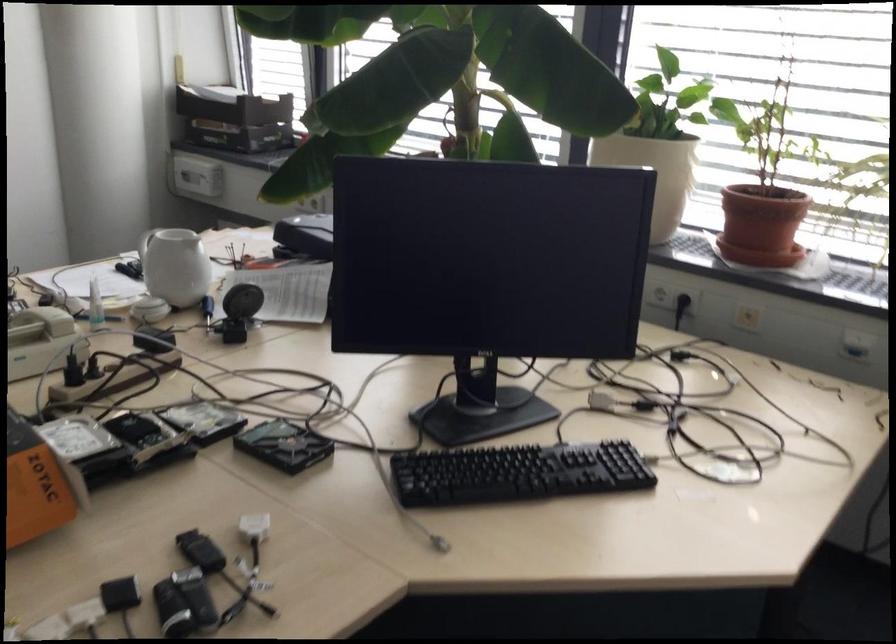
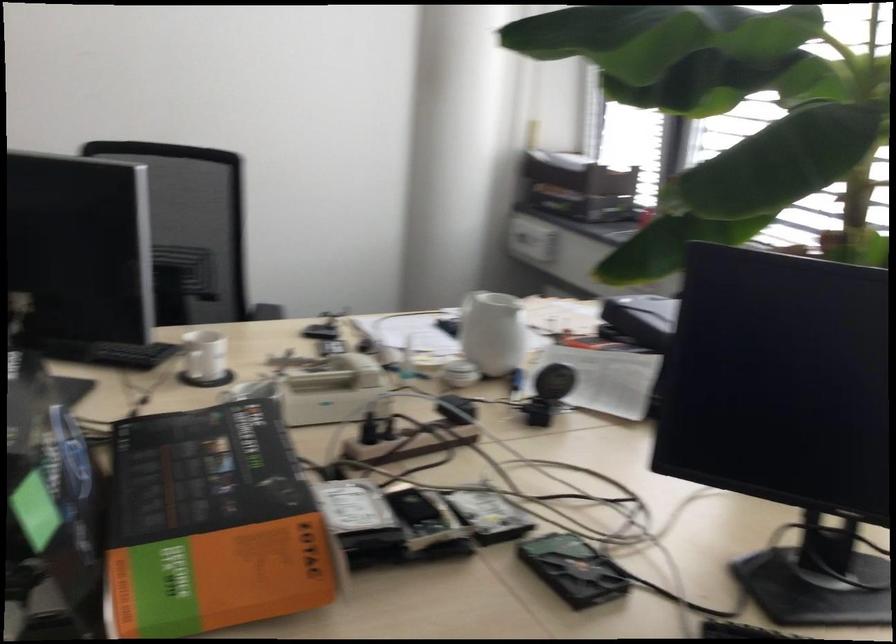
The images are taken continuously from a first-person perspective. In which direction are you moving?

The cameraman moved toward left, forward.